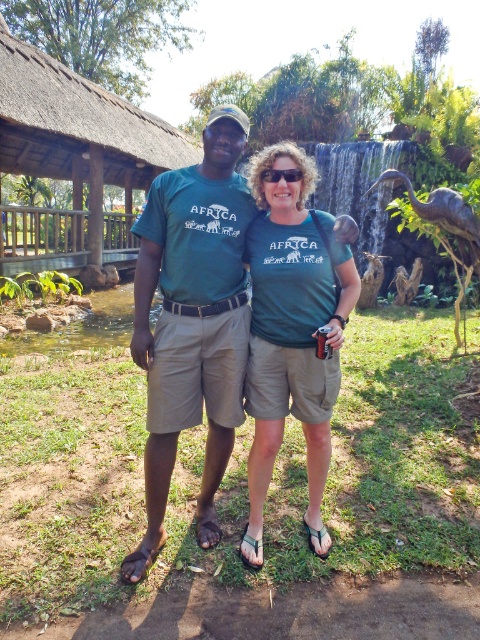
Question: Among these objects, which one is nearest to the camera?

Choices:
 (A) green cotton t-shirt at center
 (B) green matte t-shirt at center

Answer: (B)

Question: Can you confirm if green cotton t-shirt at center is positioned to the left of green matte t-shirt at center?

Choices:
 (A) yes
 (B) no

Answer: (A)

Question: Is green cotton t-shirt at center thinner than green matte t-shirt at center?

Choices:
 (A) no
 (B) yes

Answer: (A)

Question: Among these objects, which one is farthest from the camera?

Choices:
 (A) green matte t-shirt at center
 (B) green cotton t-shirt at center

Answer: (B)

Question: Does green cotton t-shirt at center appear on the left side of green matte t-shirt at center?

Choices:
 (A) no
 (B) yes

Answer: (B)